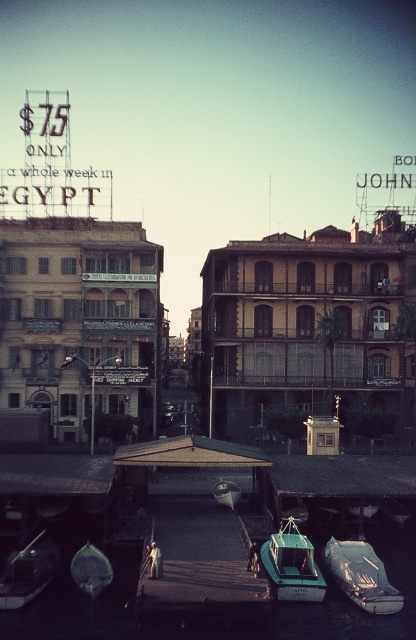
Between teal matte boat at center and teal glossy boat at center, which one has less height?

teal matte boat at center

Find the location of a particular element. The image size is (416, 640). teal matte boat at center is located at coordinates (292, 564).

Does point (282, 586) come in front of point (232, 493)?

Yes, point (282, 586) is in front of point (232, 493).

At what (x,y) coordinates should I click in order to perform the action: click on teal matte boat at center. Please return your answer as a coordinate pair (x, y). Looking at the image, I should click on (292, 564).

Who is positioned more to the right, teal matte boat at lower center or metallic silver boat at lower left?

Positioned to the right is teal matte boat at lower center.

What do you see at coordinates (361, 576) in the screenshot?
I see `teal matte boat at lower center` at bounding box center [361, 576].

Where is `teal matte boat at lower center`? teal matte boat at lower center is located at coordinates point(361,576).

Is teal matte boat at lower center taller than teal matte boat at center?

Incorrect, teal matte boat at lower center's height is not larger of teal matte boat at center's.

Between point (336, 566) and point (294, 580), which one is positioned behind?

The point (336, 566) is more distant.

Locate an element on the screen. The image size is (416, 640). teal matte boat at lower center is located at coordinates (361, 576).